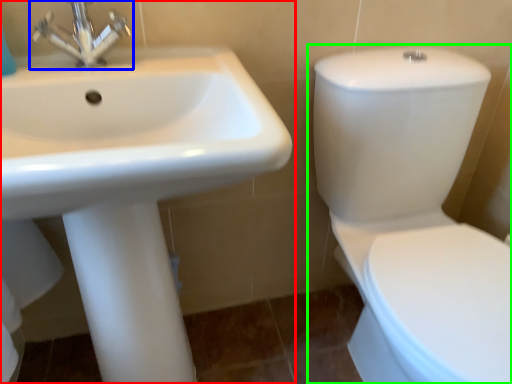
Question: Estimate the real-world distances between objects in this image. Which object is closer to sink (highlighted by a red box), tap (highlighted by a blue box) or toilet (highlighted by a green box)?

Choices:
 (A) tap
 (B) toilet

Answer: (A)